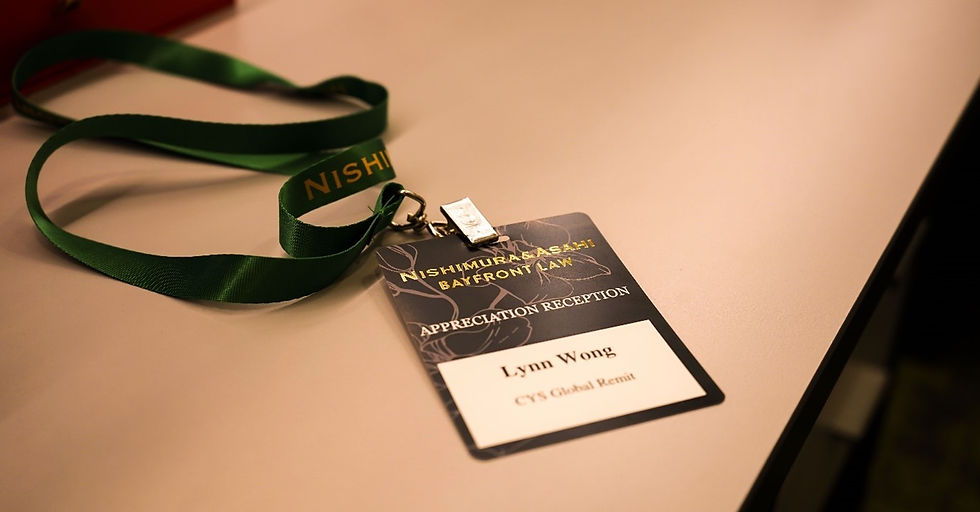
Locate an element on the screen. The image size is (980, 512). green cloth holder is located at coordinates (220, 286).